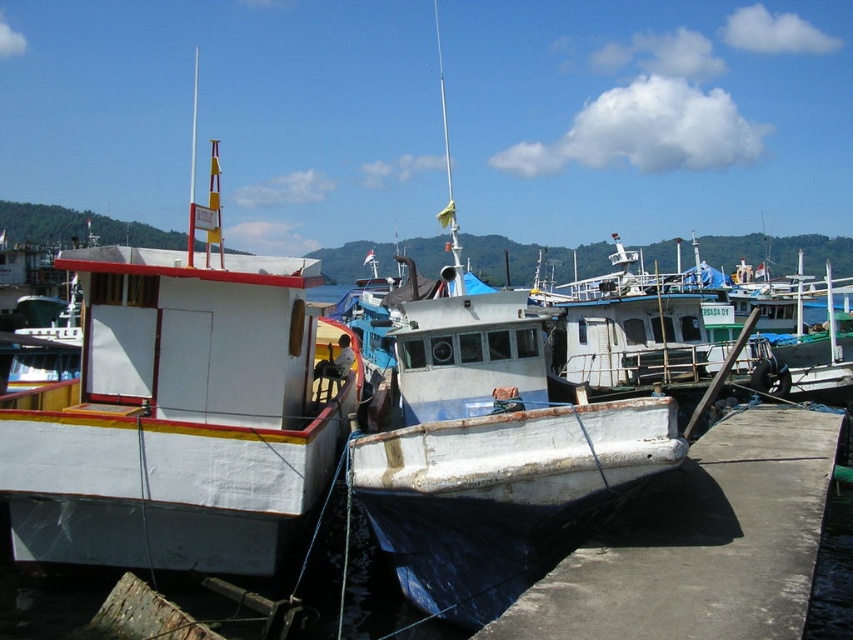
You are standing on the pier and want to board the white matte boat at center. If your average walking speed is 3 feet per second, how many seconds will it take you to reach the boat?

The white matte boat at center is 17.33 feet away from the viewer. At a walking speed of 3 feet per second, it would take approximately 5.78 seconds to reach the boat.

You are standing on the white concrete dock at lower right and want to board the white matte boat at left. Based on their positions, which direction should you walk to reach the boat?

The white matte boat at left is located above the white concrete dock at lower right, so you should walk upward from the white concrete dock at lower right to reach the white matte boat at left.

The white matte boat at center is represented by point (492, 444). Is this point located in the upper half or lower half of the image?

The point (492, 444) for the white matte boat at center is located in the lower half of the image since its y coordinate is less than 0.5.